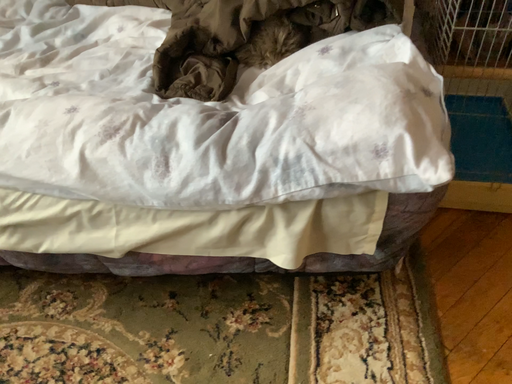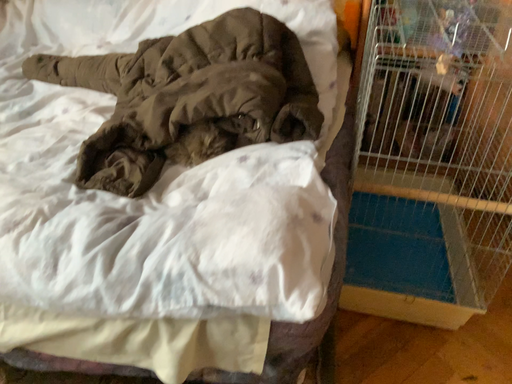
Question: How did the camera likely rotate when shooting the video?

Choices:
 (A) rotated upward
 (B) rotated downward

Answer: (A)